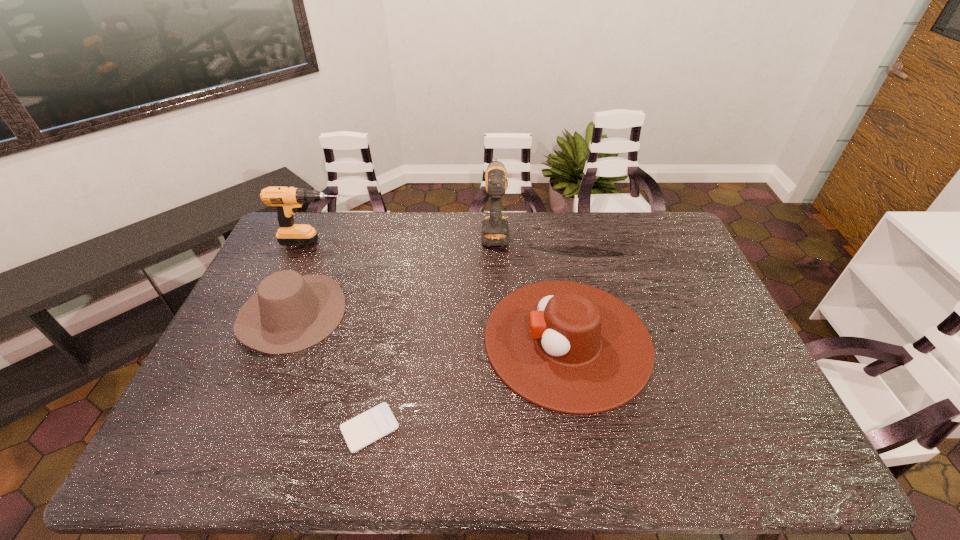
Find the location of `free area in between the right cowboy hat and the left cowboy hat`. free area in between the right cowboy hat and the left cowboy hat is located at coordinates (429, 327).

Locate an element on the screen. Image resolution: width=960 pixels, height=540 pixels. blank region between the second tallest object and the right drill is located at coordinates (407, 237).

At what (x,y) coordinates should I click in order to perform the action: click on object that is the second closest to the shortest object. Please return your answer as a coordinate pair (x, y). The width and height of the screenshot is (960, 540). Looking at the image, I should click on (568, 347).

You are a GUI agent. You are given a task and a screenshot of the screen. Output one action in this format:
    pyautogui.click(x=<x>, y=<y>)
    Task: Click on the second closest object relative to the taller drill
    Image resolution: width=960 pixels, height=540 pixels.
    Given the screenshot: What is the action you would take?
    pyautogui.click(x=289, y=313)

Where is `vacant area that satisfies the following two spatial constraints: 1. at the tip of the left cowboy hat; 2. on the left side of the left drill`? vacant area that satisfies the following two spatial constraints: 1. at the tip of the left cowboy hat; 2. on the left side of the left drill is located at coordinates (288, 313).

Image resolution: width=960 pixels, height=540 pixels. I want to click on vacant point that satisfies the following two spatial constraints: 1. at the tip of the left drill; 2. on the back side of the left cowboy hat, so click(x=288, y=313).

The image size is (960, 540). I want to click on free space that satisfies the following two spatial constraints: 1. on the front side of the left cowboy hat; 2. on the left side of the third object from left to right, so click(243, 428).

Image resolution: width=960 pixels, height=540 pixels. What are the coordinates of `free space that satisfies the following two spatial constraints: 1. at the tip of the left cowboy hat; 2. on the left side of the shorter drill` in the screenshot? It's located at (288, 313).

This screenshot has height=540, width=960. I want to click on free space that satisfies the following two spatial constraints: 1. at the tip of the left cowboy hat; 2. on the left side of the shorter drill, so click(x=288, y=313).